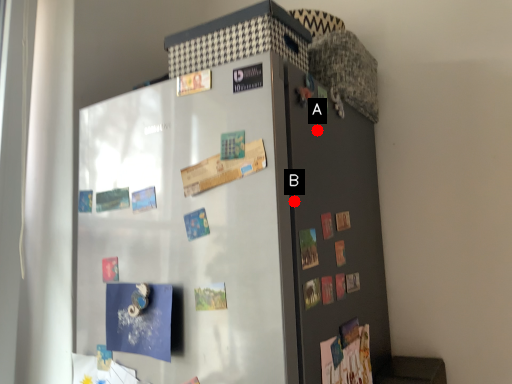
Question: Two points are circled on the image, labeled by A and B beside each circle. Which point is closer to the camera?

Choices:
 (A) A is closer
 (B) B is closer

Answer: (B)